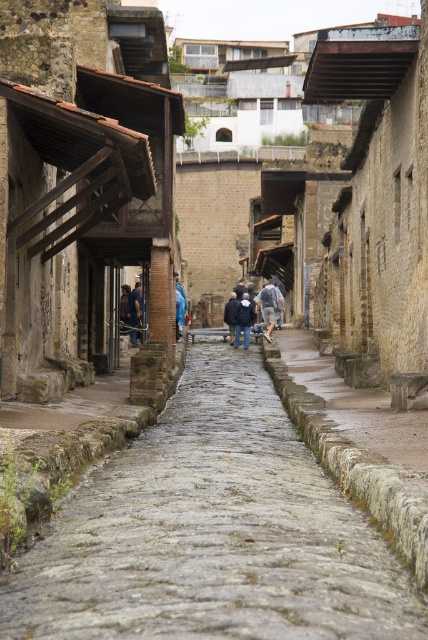
Question: Which point is farther from the camera taking this photo?

Choices:
 (A) (223, 378)
 (B) (404, 460)
 (C) (237, 316)

Answer: (C)

Question: Can you confirm if stone cobblestone path at center is thinner than dark blue fabric coat at center?

Choices:
 (A) no
 (B) yes

Answer: (B)

Question: Which point appears farthest from the camera in this image?

Choices:
 (A) (354, 429)
 (B) (267, 328)
 (C) (131, 336)

Answer: (B)

Question: Estimate the real-world distances between objects in this image. Which object is closer to the stone cobblestone path at center?

Choices:
 (A) blue denim jacket at center
 (B) denim jacket at center
 (C) dark blue fabric coat at center

Answer: (C)

Question: Is gray stone pavement at center bigger than denim jacket at center?

Choices:
 (A) yes
 (B) no

Answer: (B)

Question: Can you confirm if dark blue fabric coat at center is smaller than denim jacket at center?

Choices:
 (A) yes
 (B) no

Answer: (B)